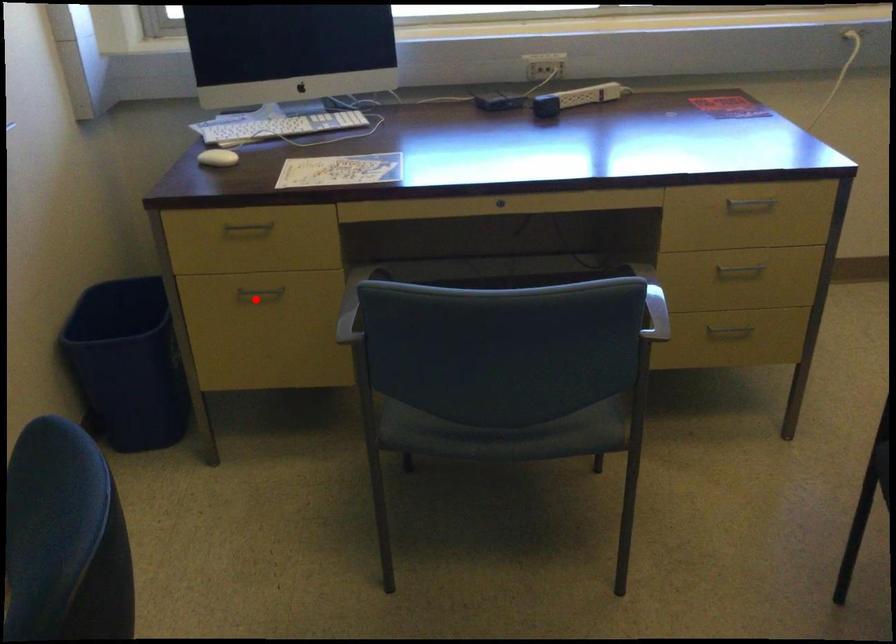
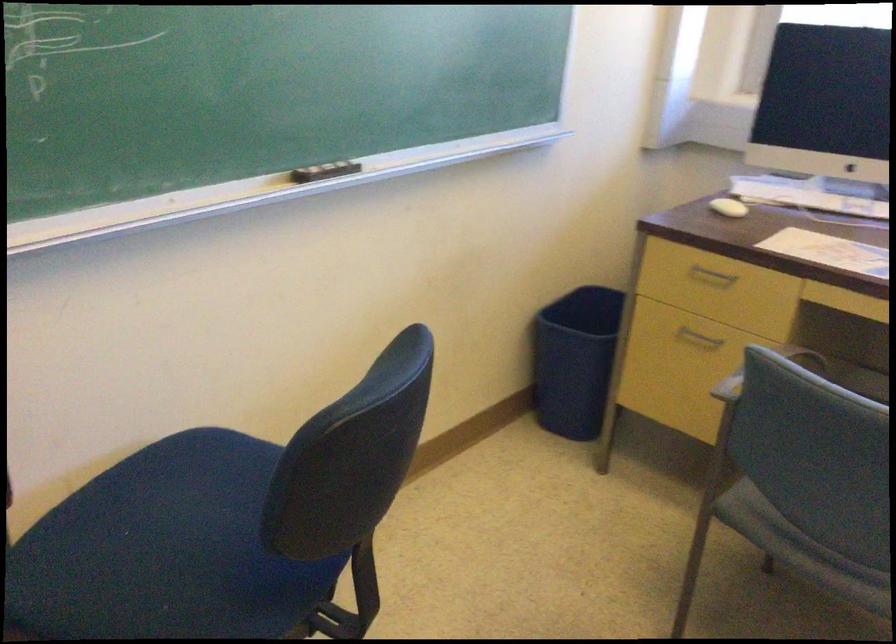
Where in the second image is the point corresponding to the highlighted location from the first image?

(698, 337)